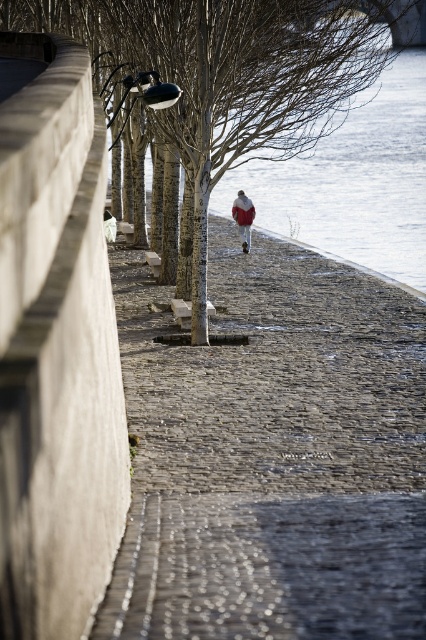
Does point (219, 508) come behind point (265, 100)?

No, it is in front of (265, 100).

Describe the element at coordinates (273, 454) in the screenshot. The width and height of the screenshot is (426, 640). I see `gray cobblestone pavement at center` at that location.

What are the coordinates of `gray cobblestone pavement at center` in the screenshot? It's located at (273, 454).

Find the location of a particular element. Image resolution: width=426 pixels, height=640 pixels. gray cobblestone pavement at center is located at coordinates (273, 454).